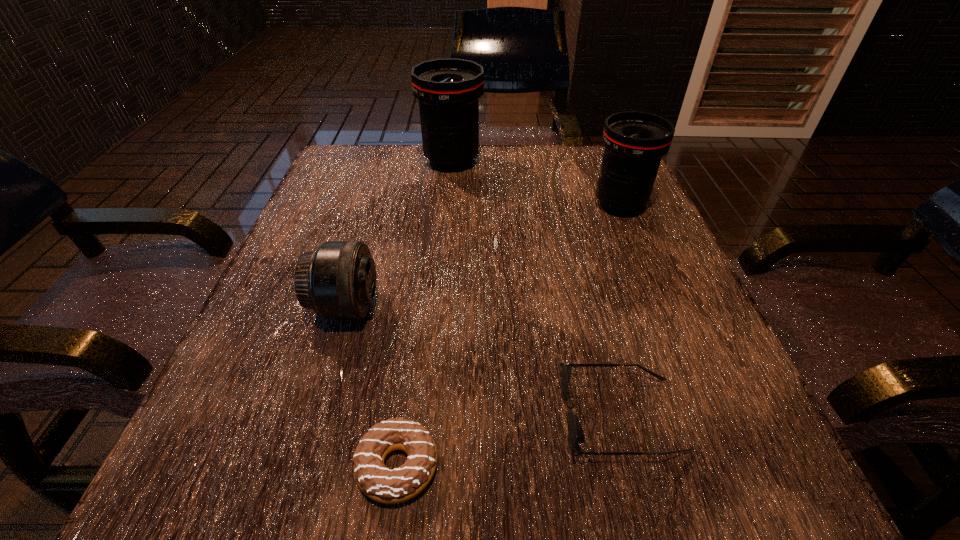
Where is `vacant area that lies between the nearest telephoto lens and the doughnut`? The height and width of the screenshot is (540, 960). vacant area that lies between the nearest telephoto lens and the doughnut is located at coordinates (372, 387).

Where is `vacant area that lies between the third shortest object and the shortest object`? Image resolution: width=960 pixels, height=540 pixels. vacant area that lies between the third shortest object and the shortest object is located at coordinates (372, 387).

Where is `vacant area that lies between the shortest object and the sunglasses`? vacant area that lies between the shortest object and the sunglasses is located at coordinates (509, 441).

Image resolution: width=960 pixels, height=540 pixels. I want to click on vacant area that lies between the doughnut and the sunglasses, so click(x=509, y=441).

Locate an element on the screen. Image resolution: width=960 pixels, height=540 pixels. free spot between the farthest telephoto lens and the third tallest object is located at coordinates (399, 234).

Where is `free spot between the shortest object and the leftmost telephoto lens`? This screenshot has width=960, height=540. free spot between the shortest object and the leftmost telephoto lens is located at coordinates (372, 387).

Find the location of a particular element. vacant area between the second shortest telephoto lens and the third tallest object is located at coordinates (483, 256).

Where is `the third closest object to the tallest object`? This screenshot has height=540, width=960. the third closest object to the tallest object is located at coordinates (576, 435).

Identify which object is located as the third nearest to the farthest telephoto lens. Please provide its 2D coordinates. Your answer should be formatted as a tuple, i.e. [(x, y)], where the tuple contains the x and y coordinates of a point satisfying the conditions above.

[(576, 435)]

Locate an element on the screen. The height and width of the screenshot is (540, 960). the closest telephoto lens to the second tallest object is located at coordinates (448, 90).